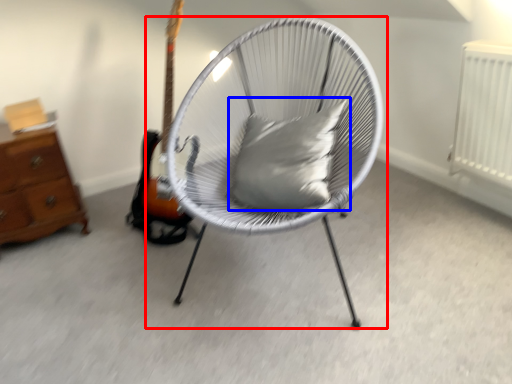
Question: Which point is closer to the camera, chair (highlighted by a red box) or pillow (highlighted by a blue box)?

Choices:
 (A) chair
 (B) pillow

Answer: (A)